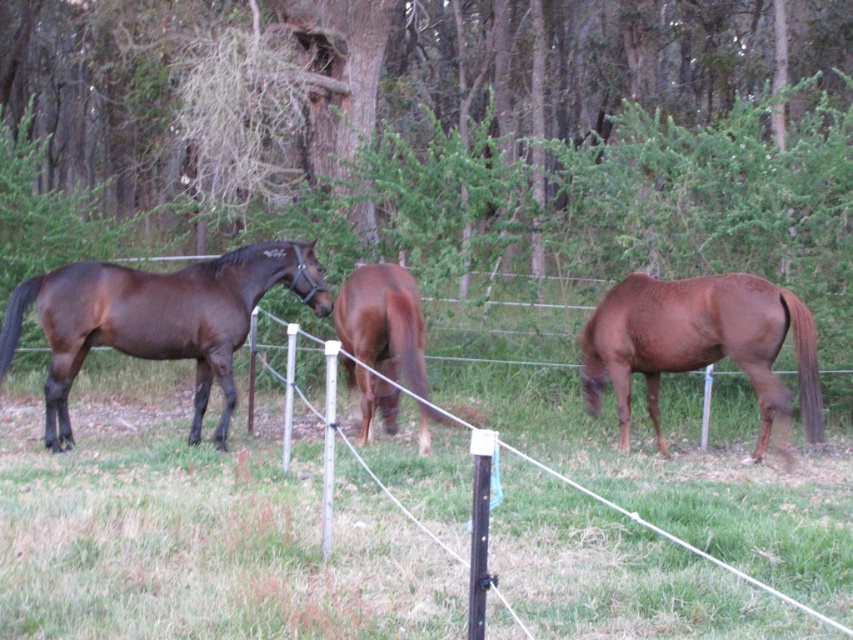
You are a farmer checking the enclosure for space. You need to determine if the brown glossy horse at right can fit through the gap between the brown glossy horse at center and the wire fence. Can it?

The brown glossy horse at right might be wider than the brown glossy horse at center, so it may not fit through the gap between them and the wire fence without moving the other horse first.

You are standing at the camera position and want to throw a ball to a point that is exactly 9 meters away. Is the point at coordinate (196, 408) within the enclosure? Please explain.

The point at coordinate (196, 408) is 8.92 meters away from the camera, which is just under 9 meters. Since the enclosure is bordered by a wire fence, the point is likely within the enclosure as it is positioned inside the fenced area described in the scene.